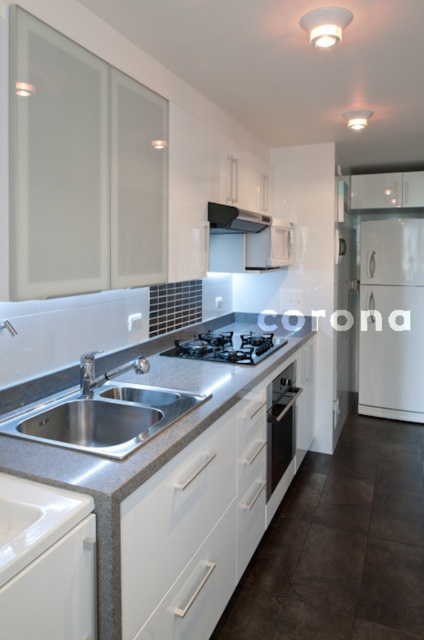
Question: Observing the image, what is the correct spatial positioning of white matte refrigerator at right in reference to black matte exhaust hood at upper center?

Choices:
 (A) above
 (B) below

Answer: (B)

Question: Which point is closer to the camera?

Choices:
 (A) (97, 429)
 (B) (217, 348)
 (C) (415, 220)
 (D) (225, 214)

Answer: (A)

Question: Which of the following is the farthest from the observer?

Choices:
 (A) click(144, 364)
 (B) click(276, 438)
 (C) click(209, 224)

Answer: (B)

Question: Which point is closer to the camera taking this photo?

Choices:
 (A) (122, 364)
 (B) (281, 461)
 (C) (36, 438)

Answer: (C)

Question: Is granite/stone countertop at center further to camera compared to black matte exhaust hood at upper center?

Choices:
 (A) no
 (B) yes

Answer: (A)

Question: Is black glass stove at center positioned behind silver metallic faucet at lower left?

Choices:
 (A) no
 (B) yes

Answer: (B)